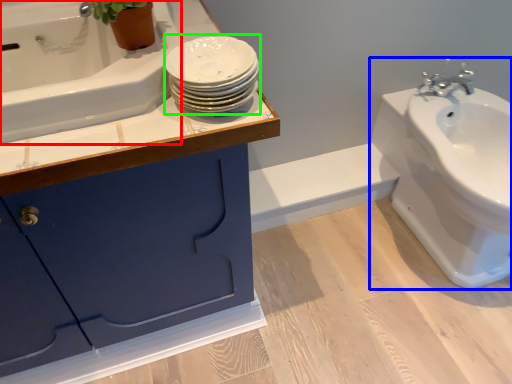
Question: Which object is positioned closest to bath (highlighted by a red box)? Select from sink (highlighted by a blue box) and porcelain (highlighted by a green box).

Choices:
 (A) sink
 (B) porcelain

Answer: (B)